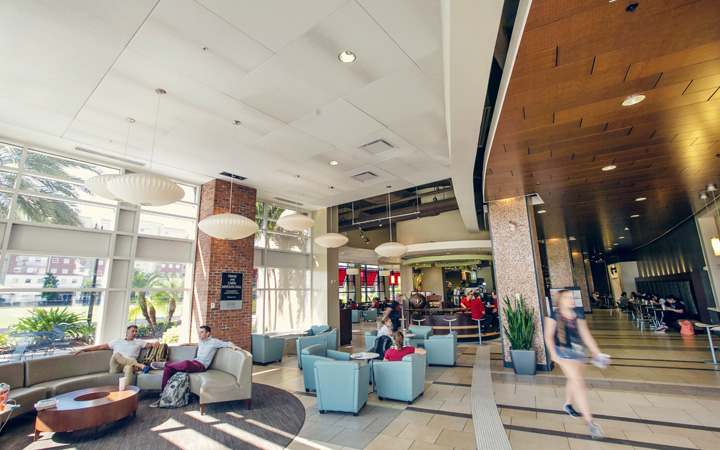
Where is `plant`? plant is located at coordinates (523, 340).